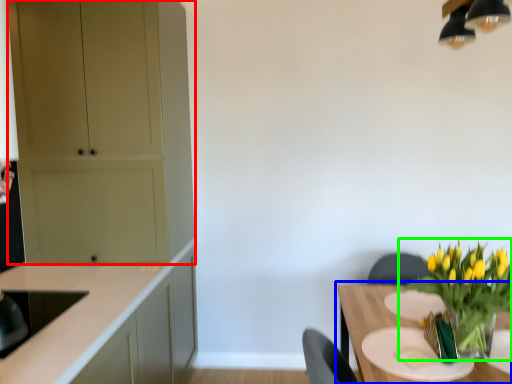
Question: Which is nearer to the cabinetry (highlighted by a red box)? table (highlighted by a blue box) or houseplant (highlighted by a green box).

Choices:
 (A) table
 (B) houseplant

Answer: (A)